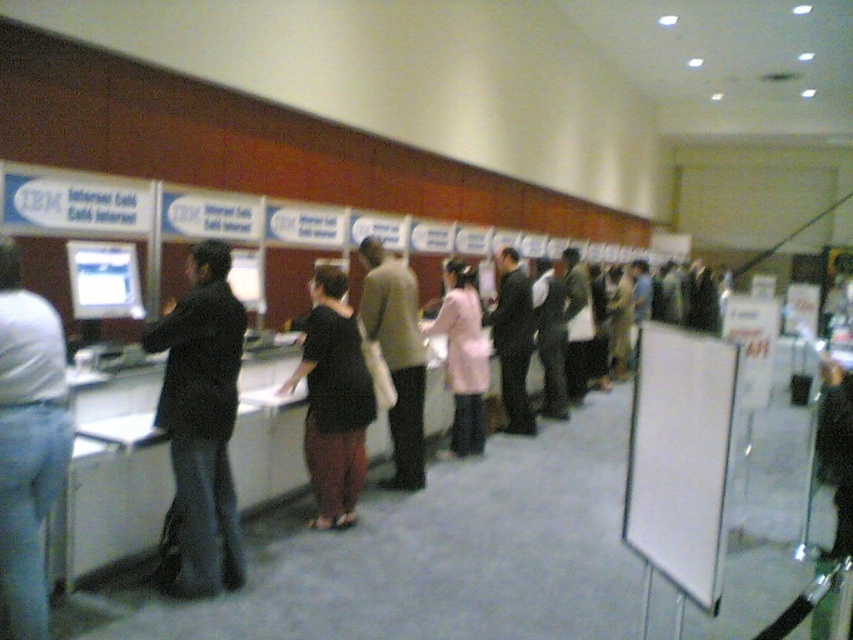
Question: Does white matte board at center appear on the right side of light brown leather jacket at center?

Choices:
 (A) no
 (B) yes

Answer: (B)

Question: Which object is closer to the camera taking this photo?

Choices:
 (A) black matte dress at center
 (B) dark gray suit at center
 (C) matte black desk at left
 (D) white matte board at center

Answer: (D)

Question: Considering the real-world distances, which object is closest to the pink fabric coat at center?

Choices:
 (A) white matte board at center
 (B) denim jeans at left
 (C) matte black desk at left

Answer: (C)

Question: Is denim jeans at left smaller than dark suit at center?

Choices:
 (A) no
 (B) yes

Answer: (B)

Question: Is matte black desk at left wider than dark suit at center?

Choices:
 (A) no
 (B) yes

Answer: (B)

Question: Which is nearer to the light brown leather jacket at center?

Choices:
 (A) white matte board at center
 (B) denim jeans at left

Answer: (B)